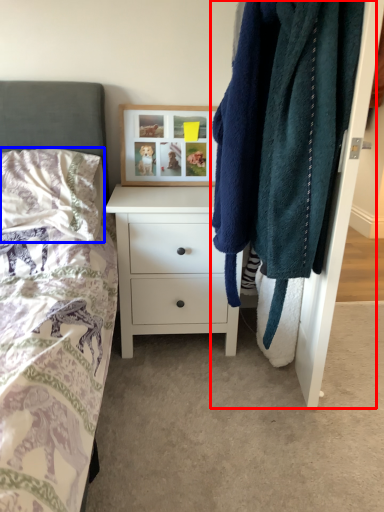
Question: Which object appears closest to the camera in this image, closet (highlighted by a red box) or pillow (highlighted by a blue box)?

Choices:
 (A) closet
 (B) pillow

Answer: (A)